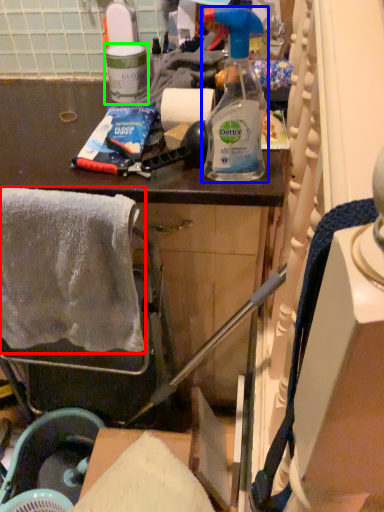
Question: Considering the real-world distances, which object is farthest from towel/napkin (highlighted by a red box)? bottle (highlighted by a blue box) or bottle (highlighted by a green box)?

Choices:
 (A) bottle
 (B) bottle

Answer: (B)